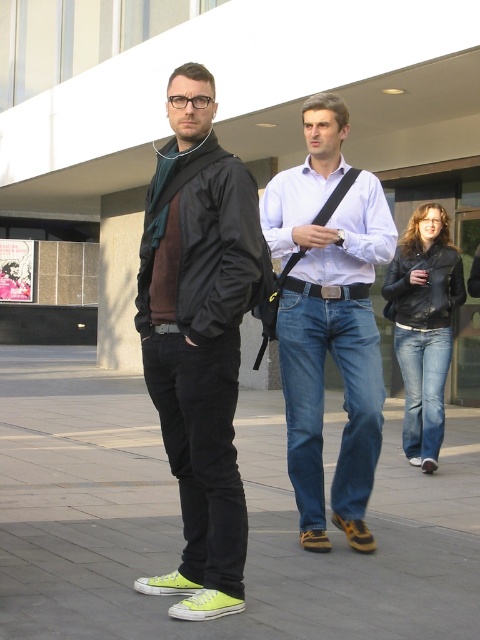
Looking at this image, measure the distance from green canvas shoes at lower center to blue denim jeans at center.

5.82 feet

Does green canvas shoes at lower center have a lesser width compared to blue denim jeans at center?

No.

Locate an element on the screen. The height and width of the screenshot is (640, 480). green canvas shoes at lower center is located at coordinates (249, 518).

At what (x,y) coordinates should I click in order to perform the action: click on green canvas shoes at lower center. Please return your answer as a coordinate pair (x, y). Looking at the image, I should click on (249, 518).

Is point (343, 164) farther from camera compared to point (400, 355)?

No, (343, 164) is in front of (400, 355).

Based on the photo, who is more distant from viewer, (294, 486) or (423, 428)?

Point (423, 428)

The image size is (480, 640). I want to click on denim jeans at center, so click(x=328, y=321).

Is the position of blue denim jeans at center more distant than that of denim at right?

No, blue denim jeans at center is in front of denim at right.

How distant is blue denim jeans at center from denim at right?

blue denim jeans at center is 2.27 meters from denim at right.

At what (x,y) coordinates should I click in order to perform the action: click on blue denim jeans at center. Please return your answer as a coordinate pair (x, y). Looking at the image, I should click on (323, 397).

Identify the location of blue denim jeans at center. The image size is (480, 640). [x=323, y=397].